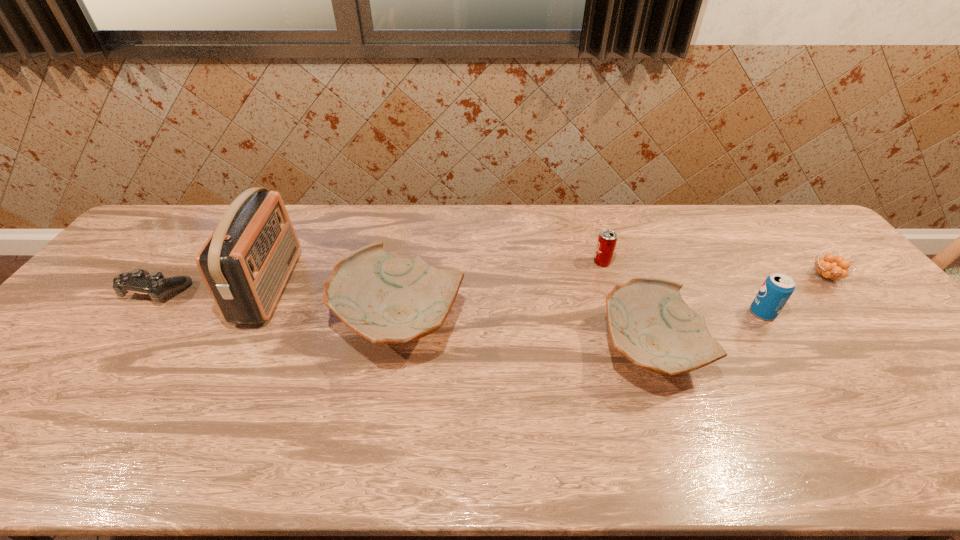
Locate an element on the screen. The image size is (960, 540). the left pottery is located at coordinates (387, 299).

Locate an element on the screen. the taller pottery is located at coordinates (387, 299).

Identify the location of the right pottery. (650, 324).

Image resolution: width=960 pixels, height=540 pixels. I want to click on the leftmost object, so click(x=157, y=286).

At what (x,y) coordinates should I click in order to perform the action: click on orange fruit. Please return your answer as a coordinate pair (x, y). Image resolution: width=960 pixels, height=540 pixels. Looking at the image, I should click on (829, 267).

Locate an element on the screen. soda can is located at coordinates (777, 288).

You are a GUI agent. You are given a task and a screenshot of the screen. Output one action in this format:
    pyautogui.click(x=<x>, y=<y>)
    Task: Click on the beer can
    
    Given the screenshot: What is the action you would take?
    pyautogui.click(x=607, y=239)

At what (x,y) coordinates should I click in order to perform the action: click on radio receiver. Please return your answer as a coordinate pair (x, y). This screenshot has height=540, width=960. Looking at the image, I should click on (246, 262).

I want to click on the second object from left to right, so [246, 262].

Image resolution: width=960 pixels, height=540 pixels. In order to click on blank space located on the right of the left pottery in this screenshot , I will do 554,322.